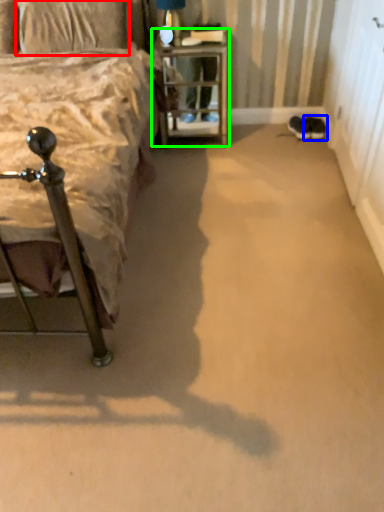
Question: Which is nearer to the pillow (highlighted by a red box)? footwear (highlighted by a blue box) or nightstand (highlighted by a green box).

Choices:
 (A) footwear
 (B) nightstand

Answer: (B)